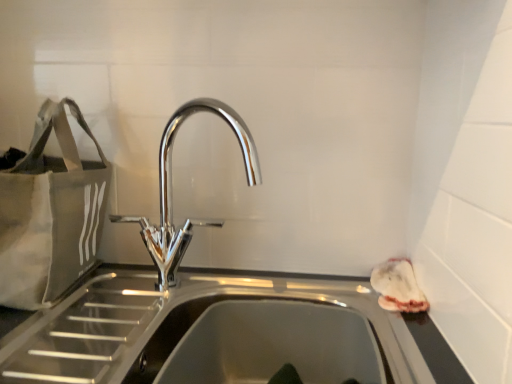
Question: From a real-world perspective, is chrome metallic tap at center positioned under matte gray tote at left based on gravity?

Choices:
 (A) yes
 (B) no

Answer: (A)

Question: Does chrome metallic tap at center lie behind matte gray tote at left?

Choices:
 (A) no
 (B) yes

Answer: (A)

Question: Is chrome metallic tap at center bigger than matte gray tote at left?

Choices:
 (A) yes
 (B) no

Answer: (B)

Question: Is chrome metallic tap at center smaller than matte gray tote at left?

Choices:
 (A) yes
 (B) no

Answer: (A)

Question: Does chrome metallic tap at center appear on the right side of matte gray tote at left?

Choices:
 (A) no
 (B) yes

Answer: (B)

Question: Is chrome metallic tap at center not within matte gray tote at left?

Choices:
 (A) yes
 (B) no

Answer: (A)

Question: From the image's perspective, does matte gray tote at left appear lower than chrome metallic tap at center?

Choices:
 (A) yes
 (B) no

Answer: (B)

Question: From a real-world perspective, does matte gray tote at left sit lower than chrome metallic tap at center?

Choices:
 (A) yes
 (B) no

Answer: (B)

Question: Considering the relative sizes of matte gray tote at left and chrome metallic tap at center in the image provided, is matte gray tote at left wider than chrome metallic tap at center?

Choices:
 (A) no
 (B) yes

Answer: (B)

Question: Considering the relative sizes of matte gray tote at left and chrome metallic tap at center in the image provided, is matte gray tote at left smaller than chrome metallic tap at center?

Choices:
 (A) yes
 (B) no

Answer: (B)

Question: Is matte gray tote at left at the right side of chrome metallic tap at center?

Choices:
 (A) yes
 (B) no

Answer: (B)

Question: Can you confirm if matte gray tote at left is positioned to the left of chrome metallic tap at center?

Choices:
 (A) yes
 (B) no

Answer: (A)

Question: Is matte gray tote at left situated inside chrome metallic tap at center or outside?

Choices:
 (A) outside
 (B) inside

Answer: (A)